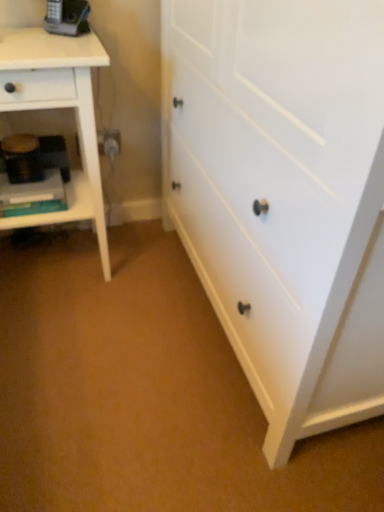
Question: Can we say white matte chest of drawers at center lies outside white wood nightstand at left?

Choices:
 (A) no
 (B) yes

Answer: (B)

Question: From the image's perspective, is white matte chest of drawers at center located above white wood nightstand at left?

Choices:
 (A) no
 (B) yes

Answer: (A)

Question: From a real-world perspective, does white matte chest of drawers at center stand above white wood nightstand at left?

Choices:
 (A) no
 (B) yes

Answer: (B)

Question: Can you confirm if white matte chest of drawers at center is positioned to the left of white wood nightstand at left?

Choices:
 (A) no
 (B) yes

Answer: (A)

Question: Is white matte chest of drawers at center taller than white wood nightstand at left?

Choices:
 (A) yes
 (B) no

Answer: (A)

Question: From the image's perspective, relative to white wood nightstand at left, is white matte chest of drawers at center above or below?

Choices:
 (A) above
 (B) below

Answer: (B)

Question: Would you say white matte chest of drawers at center is to the left or to the right of white wood nightstand at left in the picture?

Choices:
 (A) left
 (B) right

Answer: (B)

Question: Is white matte chest of drawers at center taller or shorter than white wood nightstand at left?

Choices:
 (A) tall
 (B) short

Answer: (A)

Question: Is point (329, 17) closer or farther from the camera than point (82, 114)?

Choices:
 (A) closer
 (B) farther

Answer: (A)

Question: Considering the positions of white wood nightstand at left and white matte chest of drawers at center in the image, is white wood nightstand at left taller or shorter than white matte chest of drawers at center?

Choices:
 (A) short
 (B) tall

Answer: (A)

Question: Would you say white wood nightstand at left is inside or outside white matte chest of drawers at center?

Choices:
 (A) inside
 (B) outside

Answer: (B)

Question: From the image's perspective, is white wood nightstand at left positioned above or below white matte chest of drawers at center?

Choices:
 (A) below
 (B) above

Answer: (B)

Question: Visually, is white wood nightstand at left positioned to the left or to the right of white matte chest of drawers at center?

Choices:
 (A) right
 (B) left

Answer: (B)

Question: From their relative heights in the image, would you say matte black phone at upper left is taller or shorter than white wood nightstand at left?

Choices:
 (A) short
 (B) tall

Answer: (A)

Question: From a real-world perspective, is matte black phone at upper left physically located above or below white wood nightstand at left?

Choices:
 (A) below
 (B) above

Answer: (B)